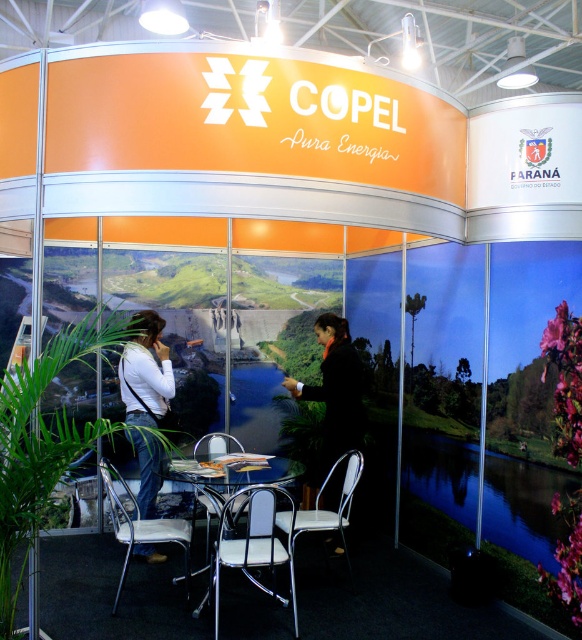
You are standing in front of the COPEL exhibition booth. There is a point marked at coordinates point (139, 492). If you want to touch this point, will you be able to reach it without moving your position? Assume your arm can extend 1.5 meters.

The point (139, 492) is 4.89 meters away from the viewer. Since your arm can only extend 1.5 meters, you cannot reach it without moving closer.